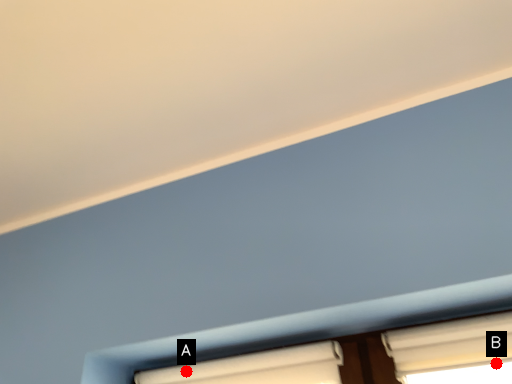
Question: Two points are circled on the image, labeled by A and B beside each circle. Which point appears closest to the camera in this image?

Choices:
 (A) A is closer
 (B) B is closer

Answer: (B)